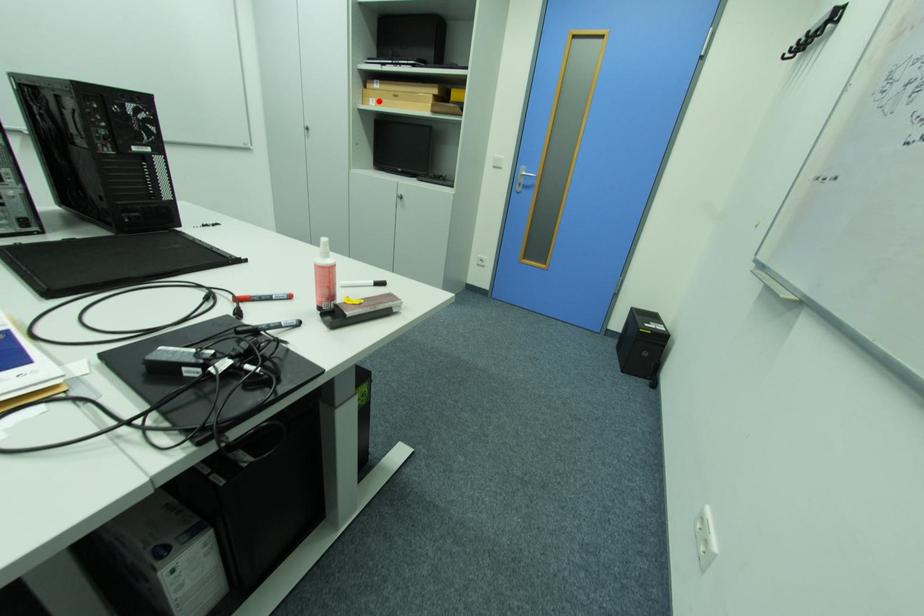
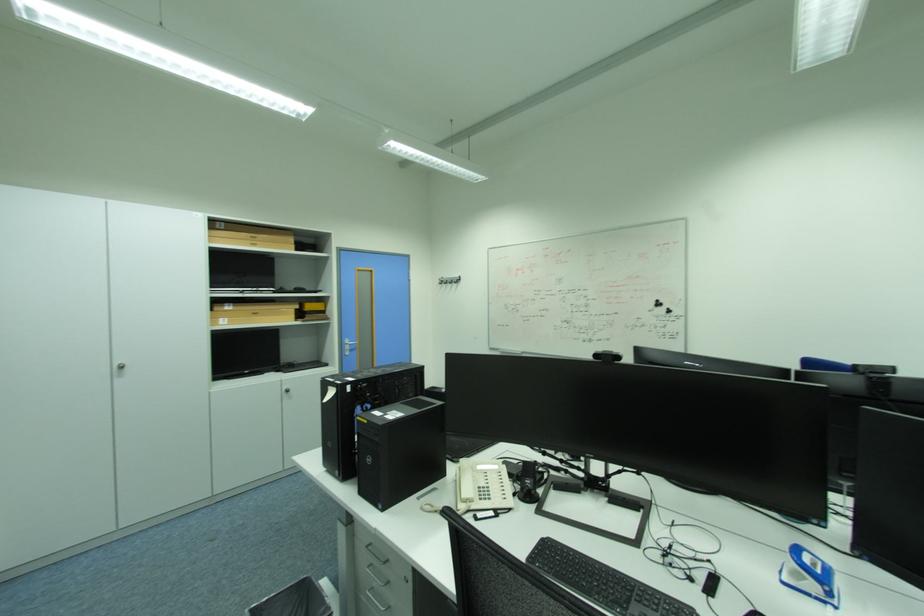
In the second image, find the point that corresponds to the highlighted location in the first image.

(228, 320)